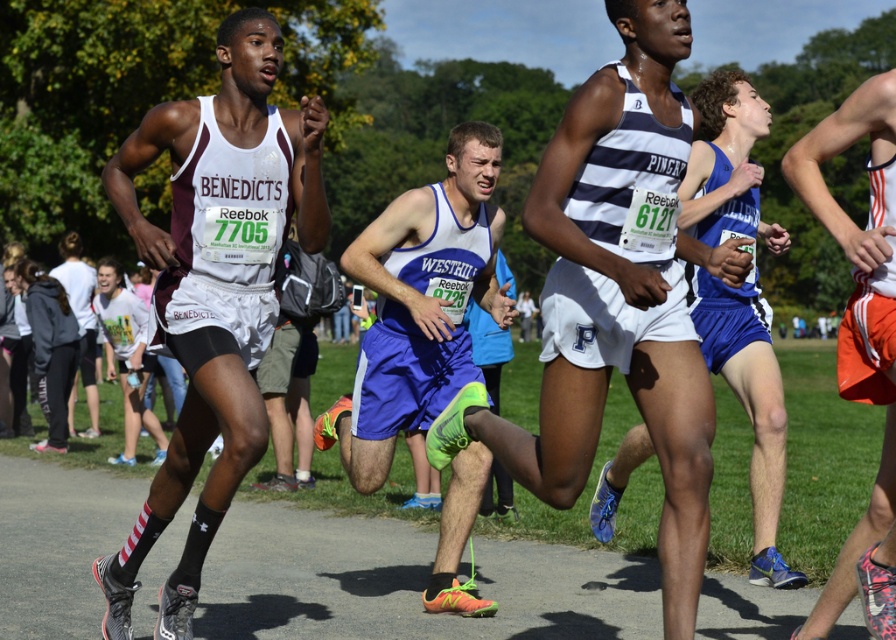
You are a photographer standing at the starting line of the cross country race. You want to capture a closeup shot of the white striped tank top at center. Given that your camera can focus on objects within 5 meters, will you be able to take the photo without moving closer?

The white striped tank top at center is 5.41 meters from the viewer, which is beyond the camera focus range of 5 meters. Therefore, you cannot take the closeup shot without moving closer.